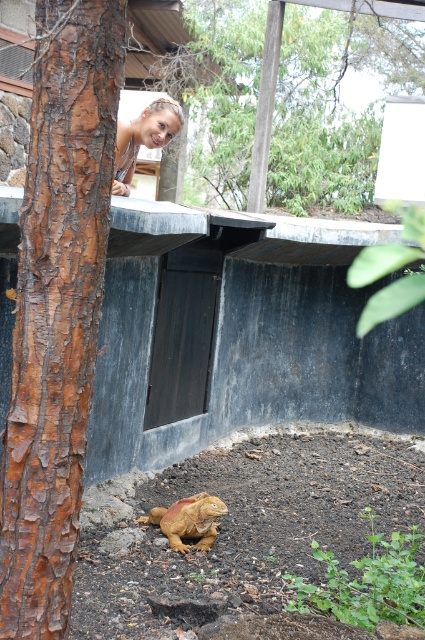
Who is positioned more to the left, brown rough bark at left or blonde hair at upper center?

From the viewer's perspective, blonde hair at upper center appears more on the left side.

Between brown rough bark at left and blonde hair at upper center, which one appears on the right side from the viewer's perspective?

brown rough bark at left is more to the right.

Which is in front, point (59, 627) or point (147, 136)?

Point (59, 627) is in front.

You are a GUI agent. You are given a task and a screenshot of the screen. Output one action in this format:
    pyautogui.click(x=<x>, y=<y>)
    Task: Click on the brown rough bark at left
    The width and height of the screenshot is (425, 640).
    Given the screenshot: What is the action you would take?
    pyautogui.click(x=57, y=307)

Who is shorter, brown rough bark at left or brown matte statue at lower center?

Standing shorter between the two is brown matte statue at lower center.

Which is in front, point (78, 148) or point (161, 512)?

Point (78, 148)

Is point (68, 38) in front of point (178, 538)?

Yes.

Where is `brown rough bark at left`? This screenshot has height=640, width=425. brown rough bark at left is located at coordinates (57, 307).

Does blonde hair at upper center have a larger size compared to brown matte statue at lower center?

Correct, blonde hair at upper center is larger in size than brown matte statue at lower center.

Does blonde hair at upper center have a lesser height compared to brown matte statue at lower center?

No.

Image resolution: width=425 pixels, height=640 pixels. In order to click on blonde hair at upper center in this screenshot , I will do `click(144, 138)`.

Image resolution: width=425 pixels, height=640 pixels. Identify the location of blonde hair at upper center. (144, 138).